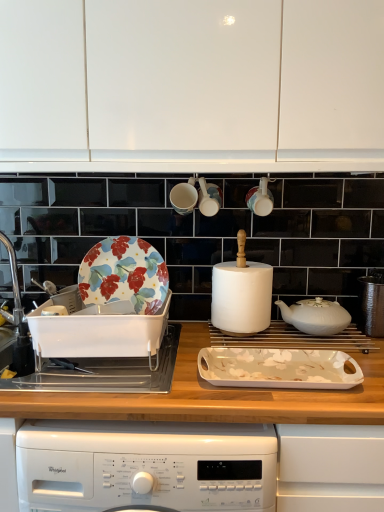
The width and height of the screenshot is (384, 512). Identify the location of vacant area situated below white ceramic teapot at center, which is the first kitchen appliance from top to bottom (from a real-world perspective). (301, 332).